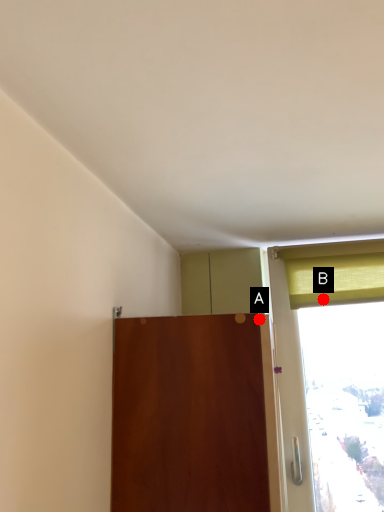
Question: Two points are circled on the image, labeled by A and B beside each circle. Which point is further to the camera?

Choices:
 (A) A is further
 (B) B is further

Answer: (B)